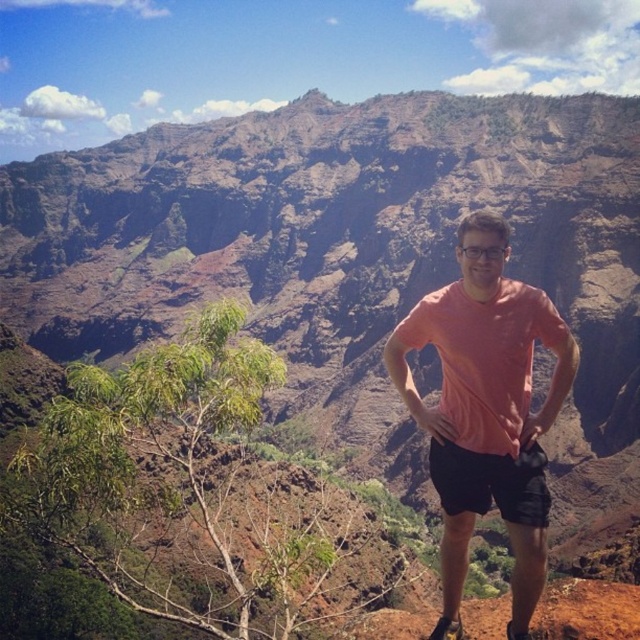
You are a photographer trying to capture the person in the canyon. Since the pink cotton shirt at center and black cotton shorts at center are both in focus, can you tell which one is closer to the camera?

The pink cotton shirt at center is in front of the black cotton shorts at center, so the pink cotton shirt at center is closer to the camera.

Based on the coordinates provided, where exactly is the pink cotton shirt at center positioned in the image?

The pink cotton shirt at center is located at point coordinates of 0.642 along the x axis and 0.761 along the y axis.

You are standing at the point marked as point (465, 221) in the image. A friend is at your location and wants to throw a small pebble towards the viewer. The pebble can travel up to 50 meters. Will the pebble reach the viewer?

The distance between point (465, 221) and the viewer is 48.90 meters. Since the pebble can travel up to 50 meters, it will just barely reach the viewer.